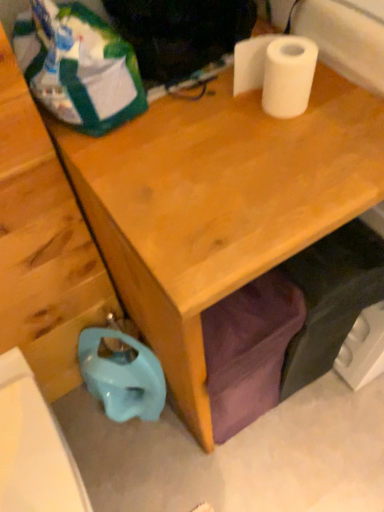
Measure the distance between matte plastic stool at lower left and camera.

The distance of matte plastic stool at lower left from camera is 24.00 inches.

The width and height of the screenshot is (384, 512). What are the coordinates of `matte plastic stool at lower left` in the screenshot? It's located at (43, 245).

What do you see at coordinates (43, 245) in the screenshot? This screenshot has height=512, width=384. I see `matte plastic stool at lower left` at bounding box center [43, 245].

Measure the distance between point (x=64, y=198) and camera.

33.58 inches.

At what (x,y) coordinates should I click in order to perform the action: click on matte plastic stool at lower left. Please return your answer as a coordinate pair (x, y). This screenshot has width=384, height=512. Looking at the image, I should click on (43, 245).